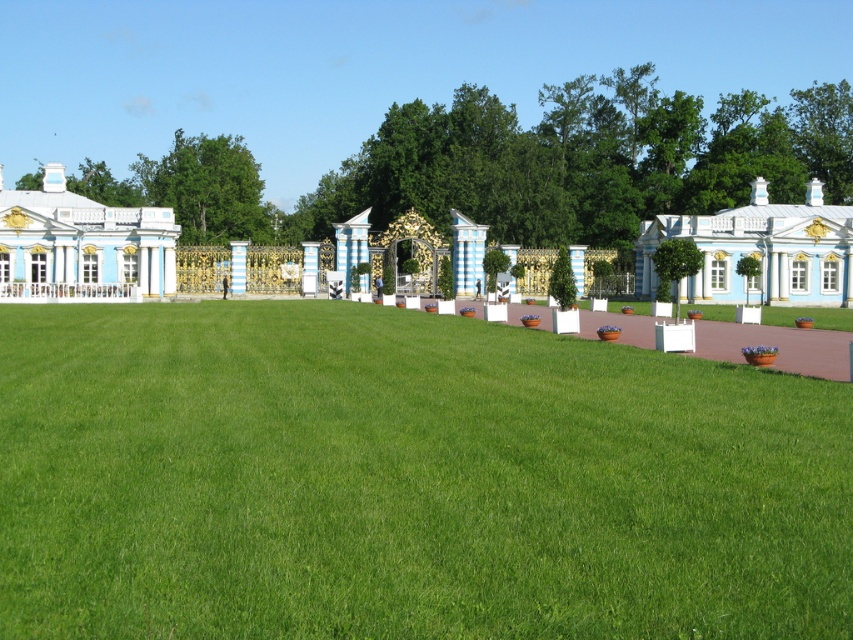
Where is `white glossy palace at left`? This screenshot has width=853, height=640. white glossy palace at left is located at coordinates (80, 244).

Is point (126, 216) farther from camera compared to point (643, 257)?

No.

Is point (28, 243) positioned after point (712, 252)?

No, (28, 243) is closer to viewer.

The width and height of the screenshot is (853, 640). I want to click on white glossy palace at left, so click(x=80, y=244).

At what (x,y) coordinates should I click in order to perform the action: click on green grass at lower center. Please return your answer as a coordinate pair (x, y). Looking at the image, I should click on (405, 481).

Can you confirm if green grass at lower center is positioned below blue painted wood palace at right?

Indeed, green grass at lower center is positioned under blue painted wood palace at right.

Image resolution: width=853 pixels, height=640 pixels. Describe the element at coordinates (405, 481) in the screenshot. I see `green grass at lower center` at that location.

You are a GUI agent. You are given a task and a screenshot of the screen. Output one action in this format:
    pyautogui.click(x=<x>, y=<y>)
    Task: Click on the green grass at lower center
    
    Given the screenshot: What is the action you would take?
    pyautogui.click(x=405, y=481)

Looking at this image, is green grass at lower center shorter than white glossy palace at left?

Yes, green grass at lower center is shorter than white glossy palace at left.

The image size is (853, 640). Describe the element at coordinates (405, 481) in the screenshot. I see `green grass at lower center` at that location.

The height and width of the screenshot is (640, 853). In order to click on green grass at lower center in this screenshot , I will do `click(405, 481)`.